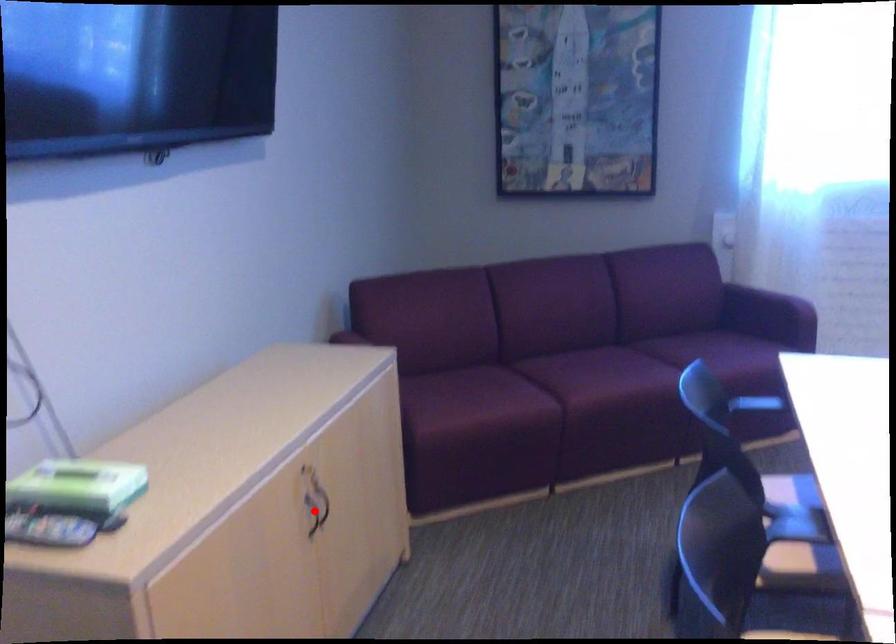
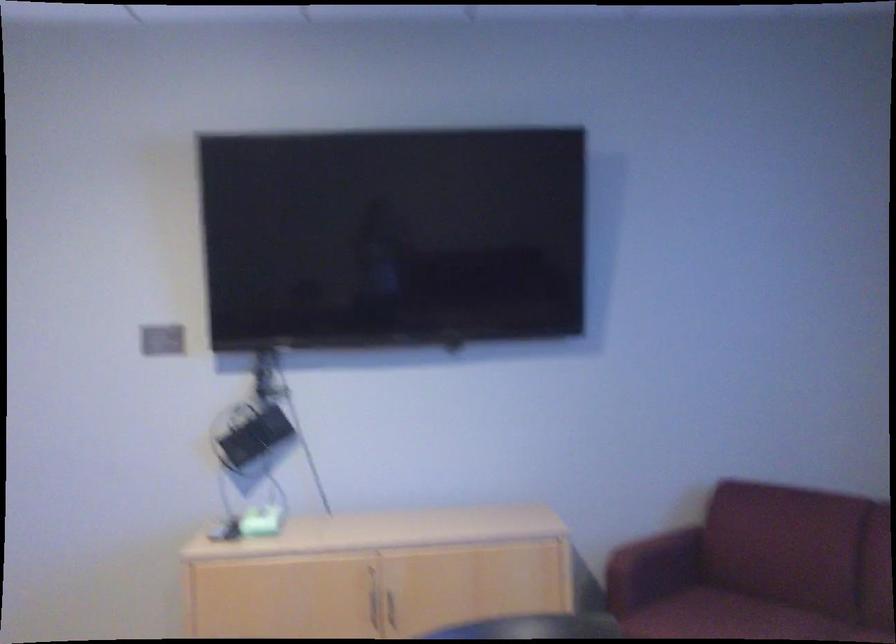
Question: I am providing you with two images of the same scene from different viewpoints. A red point is shown in image1. For the corresponding object point in image2, is it positioned nearer or farther from the camera?

Choices:
 (A) Nearer
 (B) Farther

Answer: (B)